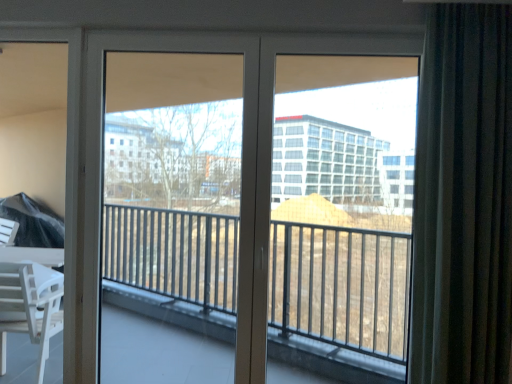
In order to face transparent glass window at center, should I rotate leftwards or rightwards?

A 11.185 degree turn to the right will do.

At what (x,y) coordinates should I click in order to perform the action: click on clear glass screen door at center. Please return your answer as a coordinate pair (x, y). Image resolution: width=512 pixels, height=384 pixels. Looking at the image, I should click on (242, 155).

You are a GUI agent. You are given a task and a screenshot of the screen. Output one action in this format:
    pyautogui.click(x=<x>, y=<y>)
    Task: Click on the white glossy door at center
    Image resolution: width=512 pixels, height=384 pixels.
    Given the screenshot: What is the action you would take?
    pyautogui.click(x=255, y=150)

From a real-world perspective, is transparent glass window at center physically located above or below clear glass screen door at center?

transparent glass window at center is situated higher than clear glass screen door at center in the real world.

Considering the sizes of objects transparent glass window at center and clear glass screen door at center in the image provided, who is taller, transparent glass window at center or clear glass screen door at center?

With more height is clear glass screen door at center.

Would you say transparent glass window at center is outside clear glass screen door at center?

Absolutely, transparent glass window at center is external to clear glass screen door at center.

Who is smaller, transparent glass window at center or clear glass screen door at center?

With smaller size is clear glass screen door at center.

Locate an element on the screen. screen door that appears behind the dark gray textured curtain at right is located at coordinates (242, 155).

Looking at this image, is dark gray textured curtain at right facing away from clear glass screen door at center?

No, dark gray textured curtain at right is not facing away from clear glass screen door at center.

From the image's perspective, relative to clear glass screen door at center, is dark gray textured curtain at right above or below?

Clearly, from the image's perspective, dark gray textured curtain at right is above clear glass screen door at center.

Where is `screen door behind the white glossy door at center`? screen door behind the white glossy door at center is located at coordinates (242, 155).

Can you tell me how much white glossy door at center and clear glass screen door at center differ in facing direction?

The facing directions of white glossy door at center and clear glass screen door at center are 0.000347 degrees apart.

Considering the sizes of objects white glossy door at center and clear glass screen door at center in the image provided, who is wider, white glossy door at center or clear glass screen door at center?

Wider between the two is white glossy door at center.

Is white glossy door at center aimed at clear glass screen door at center?

Yes, white glossy door at center is aimed at clear glass screen door at center.

Can you confirm if clear glass screen door at center is taller than dark gray textured curtain at right?

Correct, clear glass screen door at center is much taller as dark gray textured curtain at right.

Considering the sizes of objects clear glass screen door at center and dark gray textured curtain at right in the image provided, who is wider, clear glass screen door at center or dark gray textured curtain at right?

With larger width is dark gray textured curtain at right.

How different are the orientations of clear glass screen door at center and dark gray textured curtain at right in degrees?

1.42 degrees.

From the image's perspective, between clear glass screen door at center and dark gray textured curtain at right, who is located below?

clear glass screen door at center appears lower in the image.

From a real-world perspective, is dark gray textured curtain at right under transparent glass window at center?

No.

Does point (447, 16) come in front of point (405, 95)?

Yes, it is.

Is dark gray textured curtain at right spatially inside transparent glass window at center, or outside of it?

dark gray textured curtain at right exists outside the volume of transparent glass window at center.

Considering the relative positions of dark gray textured curtain at right and transparent glass window at center in the image provided, is dark gray textured curtain at right to the right of transparent glass window at center from the viewer's perspective?

Yes, dark gray textured curtain at right is to the right of transparent glass window at center.

Consider the image. How different are the orientations of transparent glass window at center and dark gray textured curtain at right in degrees?

They differ by 1.29 degrees in their facing directions.

Which object is positioned more to the left, transparent glass window at center or dark gray textured curtain at right?

From the viewer's perspective, transparent glass window at center appears more on the left side.

From the picture: Considering the sizes of transparent glass window at center and dark gray textured curtain at right in the image, is transparent glass window at center wider or thinner than dark gray textured curtain at right?

Considering their sizes, transparent glass window at center looks slimmer than dark gray textured curtain at right.

Choose the correct answer: Is transparent glass window at center inside dark gray textured curtain at right or outside it?

transparent glass window at center is outside dark gray textured curtain at right.

Is dark gray textured curtain at right inside white glossy door at center?

No, dark gray textured curtain at right is not inside white glossy door at center.

Considering the sizes of objects white glossy door at center and dark gray textured curtain at right in the image provided, who is shorter, white glossy door at center or dark gray textured curtain at right?

dark gray textured curtain at right is shorter.

Considering the sizes of objects white glossy door at center and dark gray textured curtain at right in the image provided, who is wider, white glossy door at center or dark gray textured curtain at right?

dark gray textured curtain at right.

Find the location of a particular element. curtain to the right of white glossy door at center is located at coordinates (463, 199).

Find the location of `screen door behind the transparent glass window at center`. screen door behind the transparent glass window at center is located at coordinates point(242,155).

You are a GUI agent. You are given a task and a screenshot of the screen. Output one action in this format:
    pyautogui.click(x=<x>, y=<y>)
    Task: Click on the curtain above the clear glass screen door at center (from the image's perspective)
    The height and width of the screenshot is (384, 512).
    Given the screenshot: What is the action you would take?
    pyautogui.click(x=463, y=199)

Looking at the image, which one is located further to transparent glass window at center, white glossy door at center or dark gray textured curtain at right?

white glossy door at center is further to transparent glass window at center.

Looking at the image, which one is located further to dark gray textured curtain at right, clear glass screen door at center or transparent glass window at center?

Based on the image, transparent glass window at center appears to be further to dark gray textured curtain at right.

When comparing their distances from dark gray textured curtain at right, does transparent glass window at center or white glossy door at center seem further?

The object further to dark gray textured curtain at right is transparent glass window at center.

Looking at the image, which one is located further to transparent glass window at center, dark gray textured curtain at right or clear glass screen door at center?

The object further to transparent glass window at center is clear glass screen door at center.

Looking at the image, which one is located closer to white glossy door at center, clear glass screen door at center or transparent glass window at center?

Based on the image, clear glass screen door at center appears to be nearer to white glossy door at center.

Which object lies nearer to the anchor point clear glass screen door at center, transparent glass window at center or white glossy door at center?

white glossy door at center is closer to clear glass screen door at center.

Which object lies further to the anchor point clear glass screen door at center, transparent glass window at center or dark gray textured curtain at right?

transparent glass window at center is positioned further to the anchor clear glass screen door at center.

Considering their positions, is clear glass screen door at center positioned further to transparent glass window at center than white glossy door at center?

Among the two, clear glass screen door at center is located further to transparent glass window at center.

The image size is (512, 384). I want to click on window screen between clear glass screen door at center and dark gray textured curtain at right from left to right, so click(342, 214).

Where is `door located between clear glass screen door at center and transparent glass window at center in the left-right direction`? This screenshot has height=384, width=512. door located between clear glass screen door at center and transparent glass window at center in the left-right direction is located at coordinates (255, 150).

This screenshot has height=384, width=512. What are the coordinates of `door situated between clear glass screen door at center and dark gray textured curtain at right from left to right` in the screenshot? It's located at (255, 150).

The width and height of the screenshot is (512, 384). What are the coordinates of `window screen between white glossy door at center and dark gray textured curtain at right from left to right` in the screenshot? It's located at (342, 214).